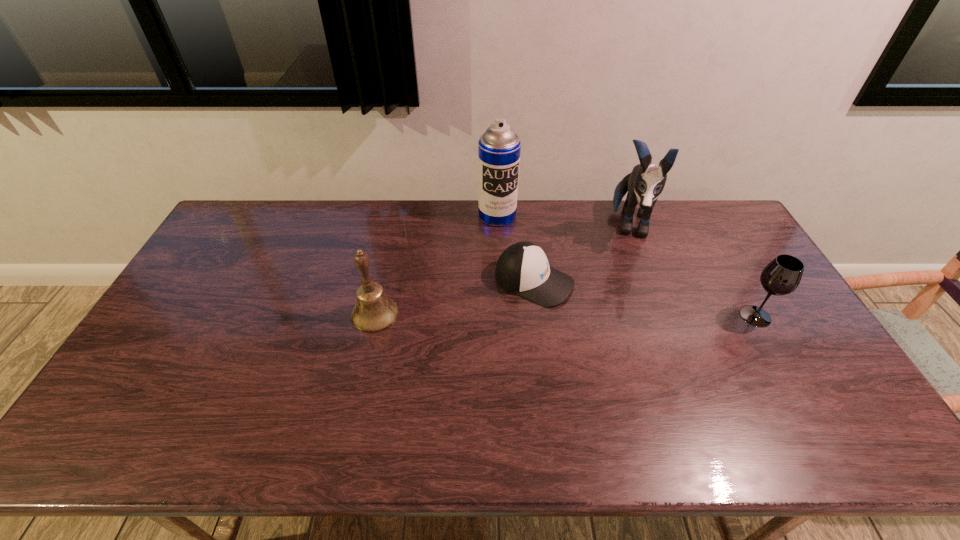
In order to click on object that is at the right edge in this screenshot , I will do `click(781, 276)`.

Identify the location of free space at the far edge of the desktop. (471, 211).

You are a GUI agent. You are given a task and a screenshot of the screen. Output one action in this format:
    pyautogui.click(x=<x>, y=<y>)
    Task: Click on the blank area at the near edge
    
    Given the screenshot: What is the action you would take?
    pyautogui.click(x=247, y=386)

Find the location of a particular element. The image size is (960, 540). blank space at the left edge is located at coordinates (256, 241).

Find the location of a particular element. The image size is (960, 540). vacant area at the far left corner of the desktop is located at coordinates click(234, 239).

Locate an element on the screen. The width and height of the screenshot is (960, 540). free space at the near right corner of the desktop is located at coordinates (823, 394).

Locate an element on the screen. Image resolution: width=960 pixels, height=540 pixels. vacant area between the shortest object and the third shortest object is located at coordinates (455, 298).

Locate an element on the screen. vacant space that is in between the leftmost object and the rightmost object is located at coordinates (565, 315).

Identify the location of vacant area between the puppy and the rightmost object. pyautogui.click(x=692, y=271).

Find the location of a particular element. The height and width of the screenshot is (540, 960). vacant area that lies between the rightmost object and the shortest object is located at coordinates (645, 299).